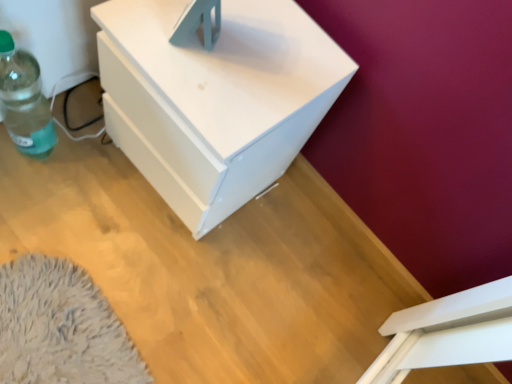
I want to click on free space in front of green translucent bottle at left, so (x=23, y=205).